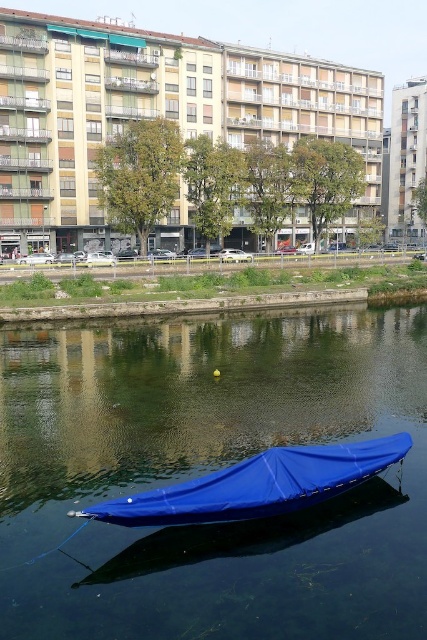
Is blue fabric boat at lower center closer to the viewer compared to blue tarpaulin boat at center?

Yes, it is.

Can you confirm if blue fabric boat at lower center is positioned below blue tarpaulin boat at center?

No.

Is point (397, 588) positioned behind point (145, 518)?

No, it is in front of (145, 518).

Locate an element on the screen. blue fabric boat at lower center is located at coordinates (207, 472).